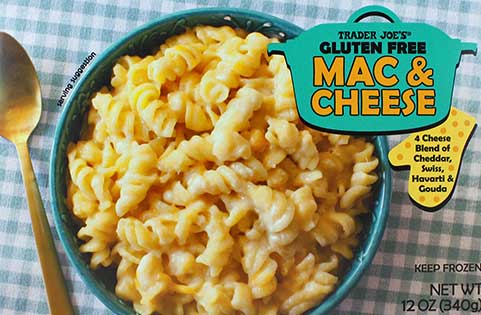
Image resolution: width=481 pixels, height=315 pixels. Find the location of `picture of blue pot`. picture of blue pot is located at coordinates (298, 51).